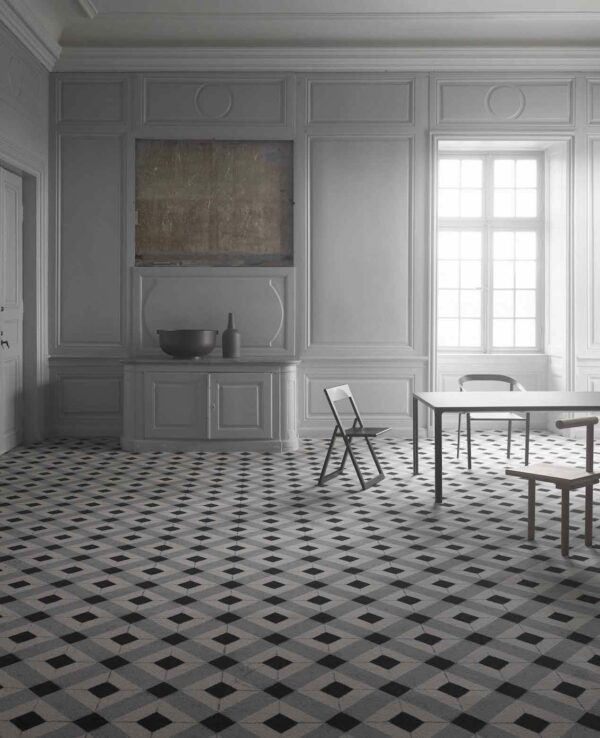
Find the location of a particular element. The image size is (600, 738). floor is located at coordinates (268, 572).